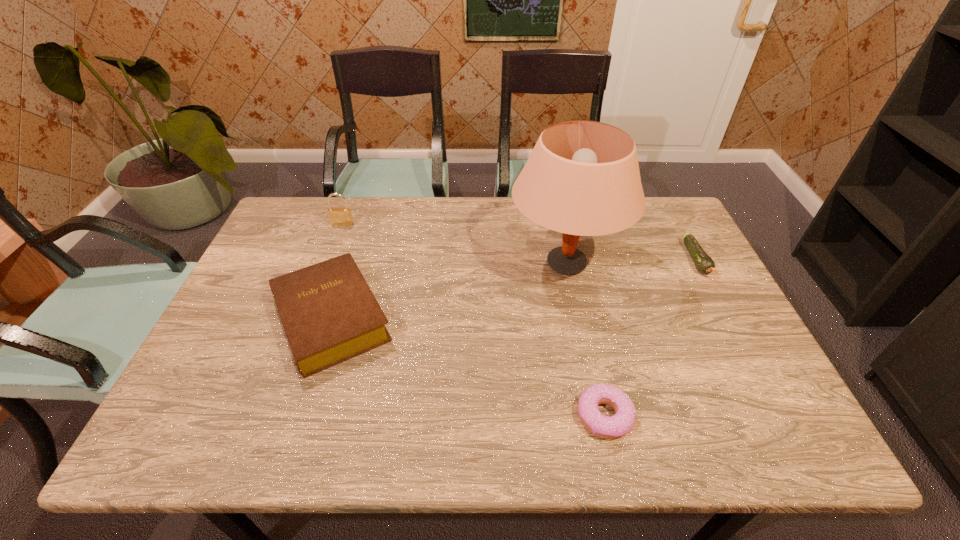
Locate an element on the screen. The width and height of the screenshot is (960, 540). vacant space in between the tallest object and the padlock is located at coordinates (454, 244).

You are a GUI agent. You are given a task and a screenshot of the screen. Output one action in this format:
    pyautogui.click(x=<x>, y=<y>)
    Task: Click on the free space between the doughnut and the rightmost object
    The image size is (960, 540).
    Given the screenshot: What is the action you would take?
    pyautogui.click(x=650, y=338)

Find the location of `vacant space that's between the farthest object and the lampshade`. vacant space that's between the farthest object and the lampshade is located at coordinates (454, 244).

Where is `vacant area that lies between the rightmost object and the farthest object`? vacant area that lies between the rightmost object and the farthest object is located at coordinates (519, 242).

In order to click on object that is the second closest to the nearest object in this screenshot , I will do `click(330, 315)`.

Image resolution: width=960 pixels, height=540 pixels. In order to click on the second closest object to the zucchini in this screenshot , I will do `click(616, 426)`.

Where is `vacant point that satisfies the following two spatial constraints: 1. on the front-facing side of the farthest object; 2. on the left side of the doughnut`? The width and height of the screenshot is (960, 540). vacant point that satisfies the following two spatial constraints: 1. on the front-facing side of the farthest object; 2. on the left side of the doughnut is located at coordinates (272, 416).

This screenshot has height=540, width=960. I want to click on free space that satisfies the following two spatial constraints: 1. on the front-facing side of the lampshade; 2. on the right side of the nearest object, so click(x=597, y=416).

Identify the location of vacant space that satisfies the following two spatial constraints: 1. at the blossom end of the zucchini; 2. on the front-facing side of the lampshade. The width and height of the screenshot is (960, 540). coord(698,263).

You are a GUI agent. You are given a task and a screenshot of the screen. Output one action in this format:
    pyautogui.click(x=<x>, y=<y>)
    Task: Click on the free space in the image that satisfies the following two spatial constraints: 1. on the back side of the nearest object; 2. on the front-facing side of the tallest object
    This screenshot has height=540, width=960.
    Given the screenshot: What is the action you would take?
    pyautogui.click(x=571, y=263)